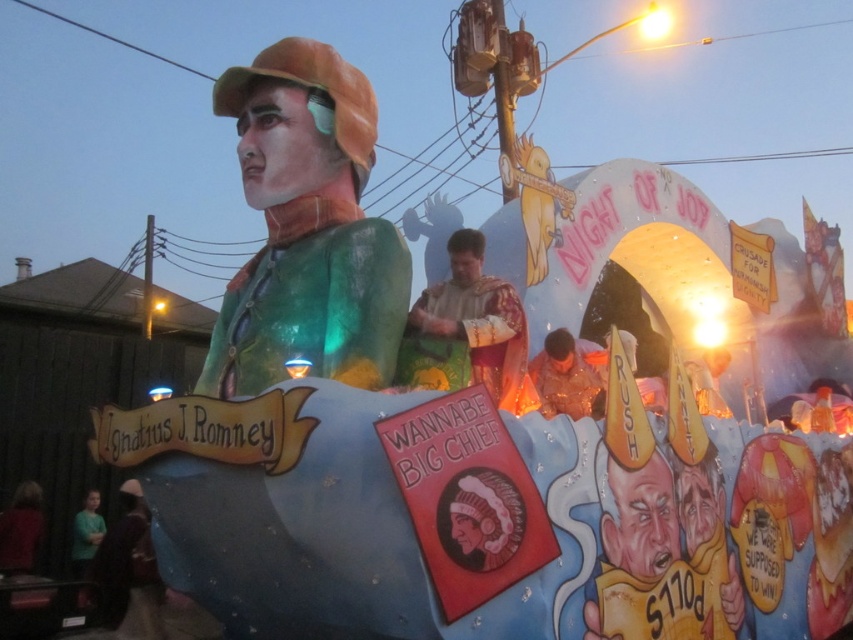
You are a drone operator tasked with capturing aerial footage of the float. The drone has a maximum flight radius of 10 meters from its starting position. If you start at the golden fabric robe at center, will the drone be able to reach the shiny gold star at center without exceeding its radius limit?

The distance between the golden fabric robe at center and the shiny gold star at center is 10.34 meters, which exceeds the drone s 10 meter radius limit. Therefore, the drone cannot reach the shiny gold star at center without exceeding its radius limit.

You are an observer standing in front of the float. There are two points marked on the float at coordinates point (x=328, y=264) and point (x=590, y=362). Which point is closer to you?

Point (x=328, y=264) is in front of point (x=590, y=362), so it is closer to you.

You are a photographer trying to capture the golden fabric robe at center in the background without the green translucent figure at center blocking it. Is this possible given their positions?

The green translucent figure at center is in front of the golden fabric robe at center, so it would block the view. To capture the golden fabric robe at center without obstruction, you would need to move around the green translucent figure at center or adjust your angle to avoid it.